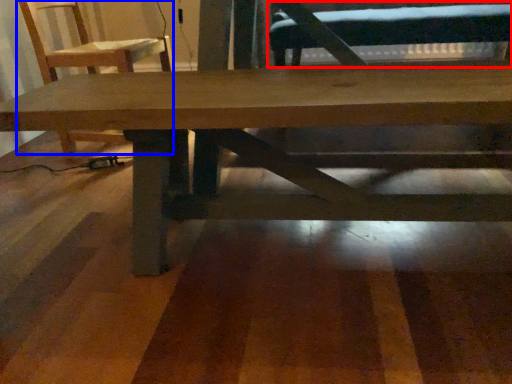
Question: Which object is closer to the camera taking this photo, swivel chair (highlighted by a red box) or chair (highlighted by a blue box)?

Choices:
 (A) swivel chair
 (B) chair

Answer: (B)